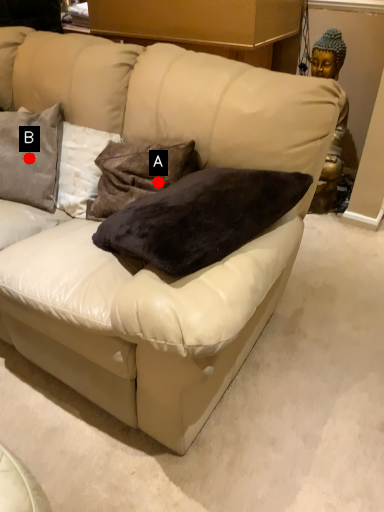
Question: Two points are circled on the image, labeled by A and B beside each circle. Which point is closer to the camera?

Choices:
 (A) A is closer
 (B) B is closer

Answer: (A)